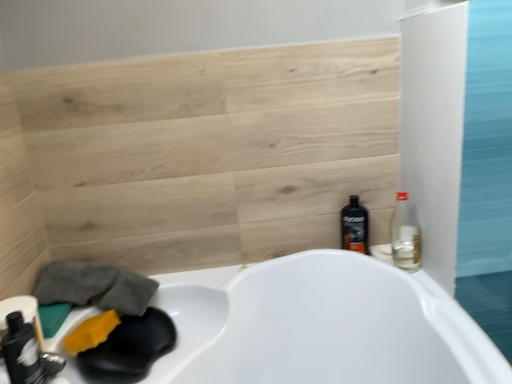
You are a GUI agent. You are given a task and a screenshot of the screen. Output one action in this format:
    pyautogui.click(x=<x>, y=<y>)
    Task: Click on the black plastic bottle at right, acting as the 1th bottle starting from the back
    This screenshot has height=384, width=512.
    Given the screenshot: What is the action you would take?
    pyautogui.click(x=354, y=227)

Image resolution: width=512 pixels, height=384 pixels. What are the coordinates of `yellow sponge at lower left` in the screenshot? It's located at (91, 332).

This screenshot has width=512, height=384. What do you see at coordinates (22, 352) in the screenshot?
I see `matte black bottle at lower left, which is the third bottle in back-to-front order` at bounding box center [22, 352].

Locate an element on the screen. black plastic bottle at right, marked as the third bottle in a front-to-back arrangement is located at coordinates (354, 227).

Are yellow sponge at lower left and matte black bottle at lower left, which is the third bottle in back-to-front order, making contact?

No, yellow sponge at lower left is not beside matte black bottle at lower left, which is the third bottle in back-to-front order.

Consider the image. Between yellow sponge at lower left and matte black bottle at lower left, which is the 3th bottle from right to left, which one is positioned behind?

yellow sponge at lower left.

Could you tell me if yellow sponge at lower left is facing matte black bottle at lower left, which is counted as the first bottle, starting from the front?

No, yellow sponge at lower left does not turn towards matte black bottle at lower left, which is counted as the first bottle, starting from the front.

Is yellow sponge at lower left taller or shorter than matte black bottle at lower left, marked as the first bottle in a left-to-right arrangement?

Clearly, yellow sponge at lower left is shorter compared to matte black bottle at lower left, marked as the first bottle in a left-to-right arrangement.

Is clear glass bottle at right, which is the first bottle from right to left, beside black plastic bottle at right, acting as the 1th bottle starting from the back?

No, clear glass bottle at right, which is the first bottle from right to left, is not touching black plastic bottle at right, acting as the 1th bottle starting from the back.

Considering the positions of objects clear glass bottle at right, which is the first bottle from right to left, and black plastic bottle at right, which ranks as the 2th bottle in right-to-left order, in the image provided, who is more to the left, clear glass bottle at right, which is the first bottle from right to left, or black plastic bottle at right, which ranks as the 2th bottle in right-to-left order,?

From the viewer's perspective, black plastic bottle at right, which ranks as the 2th bottle in right-to-left order, appears more on the left side.

Who is taller, clear glass bottle at right, acting as the second bottle starting from the back, or black plastic bottle at right, which ranks as the 2th bottle in right-to-left order?

black plastic bottle at right, which ranks as the 2th bottle in right-to-left order, is taller.

Measure the distance between clear glass bottle at right, which is the second bottle in front-to-back order, and black plastic bottle at right, placed as the second bottle when sorted from left to right.

clear glass bottle at right, which is the second bottle in front-to-back order, is 5.19 inches from black plastic bottle at right, placed as the second bottle when sorted from left to right.

In terms of height, does clear glass bottle at right, which is the second bottle in front-to-back order, look taller or shorter compared to yellow sponge at lower left?

Clearly, clear glass bottle at right, which is the second bottle in front-to-back order, is taller compared to yellow sponge at lower left.

Consider the image. From the image's perspective, between clear glass bottle at right, marked as the third bottle in a left-to-right arrangement, and yellow sponge at lower left, who is located below?

yellow sponge at lower left appears lower in the image.

From the picture: How far apart are clear glass bottle at right, which is the second bottle in front-to-back order, and yellow sponge at lower left?

The distance of clear glass bottle at right, which is the second bottle in front-to-back order, from yellow sponge at lower left is 35.14 inches.

Is clear glass bottle at right, acting as the second bottle starting from the back, turned away from yellow sponge at lower left?

No, clear glass bottle at right, acting as the second bottle starting from the back, is not facing the opposite direction of yellow sponge at lower left.

Is point (355, 248) positioned behind point (402, 199)?

That is True.

Is black plastic bottle at right, which ranks as the 2th bottle in right-to-left order, located outside clear glass bottle at right, which is the first bottle from right to left?

black plastic bottle at right, which ranks as the 2th bottle in right-to-left order, lies outside clear glass bottle at right, which is the first bottle from right to left,'s area.

I want to click on bottle that is the 2nd object directly below the clear glass bottle at right, which is the second bottle in front-to-back order (from a real-world perspective), so click(354, 227).

Is black plastic bottle at right, marked as the third bottle in a front-to-back arrangement, far away from clear glass bottle at right, which is the first bottle from right to left?

black plastic bottle at right, marked as the third bottle in a front-to-back arrangement, is actually quite close to clear glass bottle at right, which is the first bottle from right to left.

Is black plastic bottle at right, which ranks as the 2th bottle in right-to-left order, to the left of yellow sponge at lower left from the viewer's perspective?

No.

Does point (349, 224) come behind point (102, 325)?

Yes.

Is black plastic bottle at right, which ranks as the 2th bottle in right-to-left order, directly adjacent to yellow sponge at lower left?

black plastic bottle at right, which ranks as the 2th bottle in right-to-left order, and yellow sponge at lower left are clearly separated.

Is black plastic bottle at right, which ranks as the 2th bottle in right-to-left order, bigger than yellow sponge at lower left?

Yes.

Is clear glass bottle at right, marked as the third bottle in a left-to-right arrangement, outside of matte black bottle at lower left, which is the 3th bottle from right to left?

That's correct, clear glass bottle at right, marked as the third bottle in a left-to-right arrangement, is outside of matte black bottle at lower left, which is the 3th bottle from right to left.

Consider the image. How much distance is there between clear glass bottle at right, marked as the third bottle in a left-to-right arrangement, and matte black bottle at lower left, which is the 3th bottle from right to left?

clear glass bottle at right, marked as the third bottle in a left-to-right arrangement, is 3.37 feet away from matte black bottle at lower left, which is the 3th bottle from right to left.

From the image's perspective, which object appears higher, clear glass bottle at right, which is the second bottle in front-to-back order, or matte black bottle at lower left, which is the third bottle in back-to-front order?

clear glass bottle at right, which is the second bottle in front-to-back order, from the image's perspective.

Is clear glass bottle at right, which is the second bottle in front-to-back order, oriented towards matte black bottle at lower left, which is the third bottle in back-to-front order?

No, clear glass bottle at right, which is the second bottle in front-to-back order, is not oriented towards matte black bottle at lower left, which is the third bottle in back-to-front order.

Is matte black bottle at lower left, marked as the first bottle in a left-to-right arrangement, oriented away from black plastic bottle at right, acting as the 1th bottle starting from the back?

No, black plastic bottle at right, acting as the 1th bottle starting from the back, is not at the back of matte black bottle at lower left, marked as the first bottle in a left-to-right arrangement.

Is matte black bottle at lower left, marked as the first bottle in a left-to-right arrangement, positioned before black plastic bottle at right, which ranks as the 2th bottle in right-to-left order?

Yes, matte black bottle at lower left, marked as the first bottle in a left-to-right arrangement, is in front of black plastic bottle at right, which ranks as the 2th bottle in right-to-left order.

Which is behind, point (25, 382) or point (343, 244)?

The point (343, 244) is more distant.

From the image's perspective, which object appears higher, matte black bottle at lower left, which is counted as the first bottle, starting from the front, or black plastic bottle at right, marked as the third bottle in a front-to-back arrangement?

black plastic bottle at right, marked as the third bottle in a front-to-back arrangement, from the image's perspective.

The image size is (512, 384). I want to click on soap behind the matte black bottle at lower left, which is the third bottle in back-to-front order, so click(91, 332).

Locate an element on the screen. bottle that is the 2nd object above the black plastic bottle at right, placed as the second bottle when sorted from left to right (from a real-world perspective) is located at coordinates (405, 235).

Based on their spatial positions, is yellow sponge at lower left or matte black bottle at lower left, marked as the first bottle in a left-to-right arrangement, further from black plastic bottle at right, marked as the third bottle in a front-to-back arrangement?

matte black bottle at lower left, marked as the first bottle in a left-to-right arrangement, is further to black plastic bottle at right, marked as the third bottle in a front-to-back arrangement.

Estimate the real-world distances between objects in this image. Which object is closer to black plastic bottle at right, acting as the 1th bottle starting from the back, clear glass bottle at right, marked as the third bottle in a left-to-right arrangement, or yellow sponge at lower left?

Among the two, clear glass bottle at right, marked as the third bottle in a left-to-right arrangement, is located nearer to black plastic bottle at right, acting as the 1th bottle starting from the back.

Looking at the image, which one is located closer to clear glass bottle at right, which is the second bottle in front-to-back order, yellow sponge at lower left or matte black bottle at lower left, which is counted as the first bottle, starting from the front?

yellow sponge at lower left lies closer to clear glass bottle at right, which is the second bottle in front-to-back order, than the other object.

Based on their spatial positions, is clear glass bottle at right, which is the second bottle in front-to-back order, or black plastic bottle at right, placed as the second bottle when sorted from left to right, further from yellow sponge at lower left?

Among the two, clear glass bottle at right, which is the second bottle in front-to-back order, is located further to yellow sponge at lower left.

Based on their spatial positions, is clear glass bottle at right, acting as the second bottle starting from the back, or yellow sponge at lower left closer to matte black bottle at lower left, which is counted as the first bottle, starting from the front?

yellow sponge at lower left lies closer to matte black bottle at lower left, which is counted as the first bottle, starting from the front, than the other object.

From the image, which object appears to be nearer to clear glass bottle at right, which is the first bottle from right to left, matte black bottle at lower left, which is the third bottle in back-to-front order, or yellow sponge at lower left?

Among the two, yellow sponge at lower left is located nearer to clear glass bottle at right, which is the first bottle from right to left.

Considering their positions, is black plastic bottle at right, placed as the second bottle when sorted from left to right, positioned closer to yellow sponge at lower left than matte black bottle at lower left, which is the 3th bottle from right to left?

matte black bottle at lower left, which is the 3th bottle from right to left, is positioned closer to the anchor yellow sponge at lower left.

Estimate the real-world distances between objects in this image. Which object is closer to yellow sponge at lower left, clear glass bottle at right, marked as the third bottle in a left-to-right arrangement, or matte black bottle at lower left, which is the 3th bottle from right to left?

matte black bottle at lower left, which is the 3th bottle from right to left, is closer to yellow sponge at lower left.

Identify the location of bottle located between yellow sponge at lower left and clear glass bottle at right, marked as the third bottle in a left-to-right arrangement, in the left-right direction. Image resolution: width=512 pixels, height=384 pixels. (354, 227).

Where is `soap situated between matte black bottle at lower left, marked as the first bottle in a left-to-right arrangement, and clear glass bottle at right, marked as the third bottle in a left-to-right arrangement, from left to right`? soap situated between matte black bottle at lower left, marked as the first bottle in a left-to-right arrangement, and clear glass bottle at right, marked as the third bottle in a left-to-right arrangement, from left to right is located at coordinates (91, 332).

The height and width of the screenshot is (384, 512). Identify the location of soap between matte black bottle at lower left, which is counted as the first bottle, starting from the front, and black plastic bottle at right, marked as the third bottle in a front-to-back arrangement. (91, 332).

The height and width of the screenshot is (384, 512). I want to click on bottle between matte black bottle at lower left, which is counted as the first bottle, starting from the front, and clear glass bottle at right, which is the second bottle in front-to-back order, from left to right, so click(354, 227).